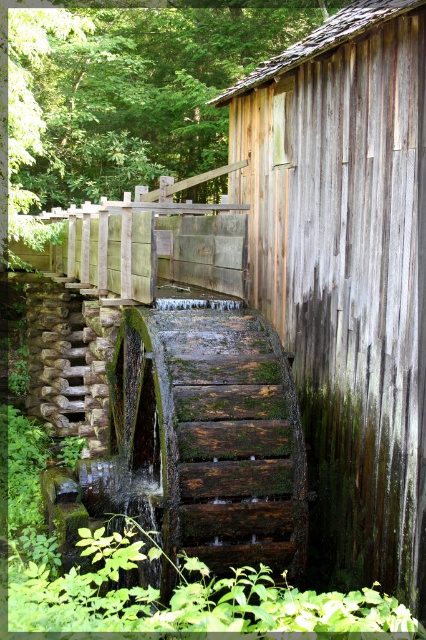
Is the position of weathered wood hut at center-right more distant than that of green mossy wood at center?

No, it is in front of green mossy wood at center.

Is weathered wood hut at center-right smaller than green mossy wood at center?

Actually, weathered wood hut at center-right might be larger than green mossy wood at center.

This screenshot has width=426, height=640. What do you see at coordinates (347, 275) in the screenshot?
I see `weathered wood hut at center-right` at bounding box center [347, 275].

I want to click on weathered wood hut at center-right, so click(x=347, y=275).